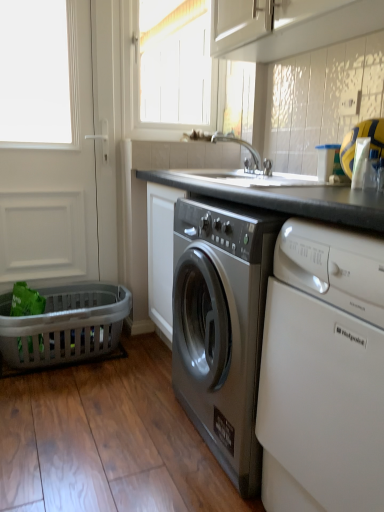
Question: Considering the positions of black granite countertop at center and white matte screen door at left in the image, is black granite countertop at center wider or thinner than white matte screen door at left?

Choices:
 (A) wide
 (B) thin

Answer: (A)

Question: From the image's perspective, is black granite countertop at center positioned above or below white matte screen door at left?

Choices:
 (A) above
 (B) below

Answer: (B)

Question: Estimate the real-world distances between objects in this image. Which object is farther from the gray plastic laundry basket at lower left?

Choices:
 (A) white matte screen door at left
 (B) black granite countertop at center
 (C) white wood window at upper center
 (D) white glossy dishwasher at right
 (E) white glossy cabinet at upper center

Answer: (C)

Question: Estimate the real-world distances between objects in this image. Which object is farther from the white glossy cabinet at upper center?

Choices:
 (A) black granite countertop at center
 (B) white glossy dishwasher at right
 (C) white wood window at upper center
 (D) white matte screen door at left
 (E) gray plastic laundry basket at lower left

Answer: (C)